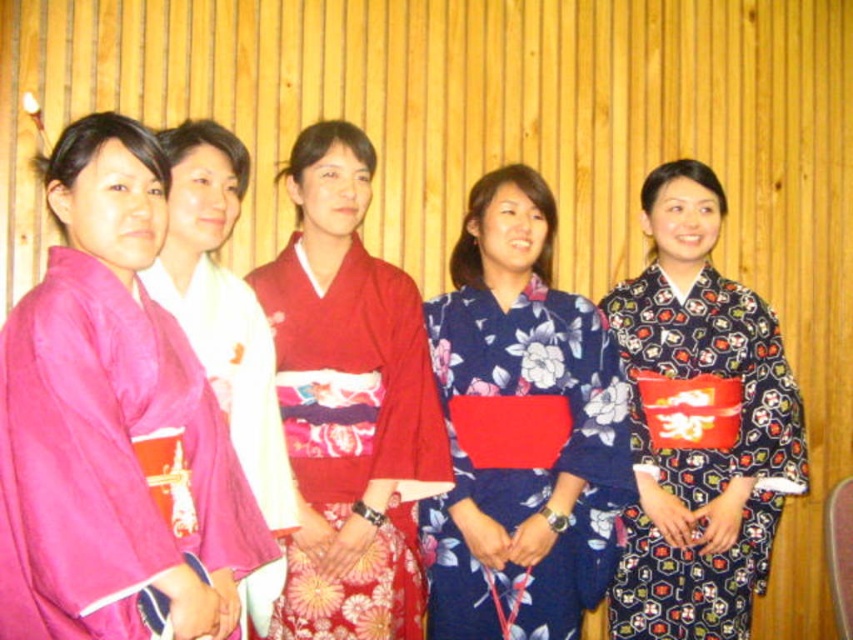
Question: Can you confirm if red satin kimono at center is smaller than pink silk kimono at left?

Choices:
 (A) yes
 (B) no

Answer: (B)

Question: Is the position of red satin kimono at center more distant than that of floral-patterned kimono at right?

Choices:
 (A) yes
 (B) no

Answer: (B)

Question: Is floral kimono at center smaller than pink silk kimono at left?

Choices:
 (A) yes
 (B) no

Answer: (B)

Question: Which point appears farthest from the camera in this image?

Choices:
 (A) (171, 288)
 (B) (120, 356)

Answer: (A)

Question: Based on their relative distances, which object is nearer to the red satin kimono at center?

Choices:
 (A) floral-patterned kimono at right
 (B) pink silk kimono at left

Answer: (B)

Question: Which point is closer to the camera?

Choices:
 (A) (750, 445)
 (B) (247, 321)
 (C) (503, 634)
 (D) (317, 627)

Answer: (D)